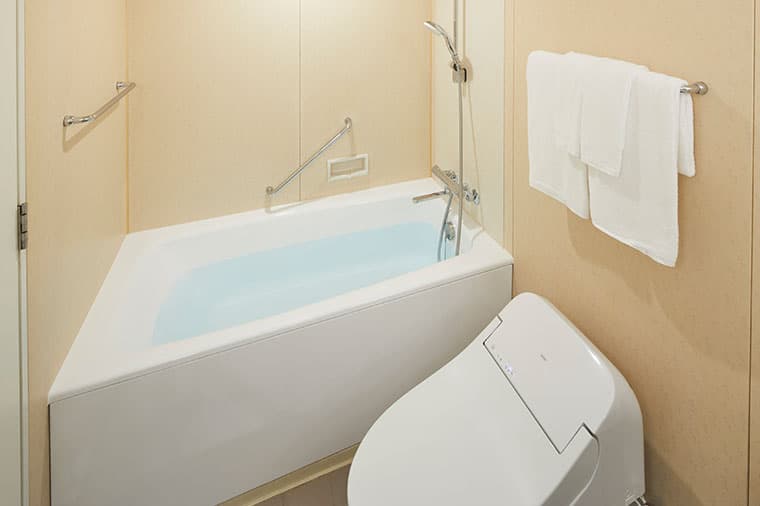
Where is `wall`? wall is located at coordinates (705, 319).